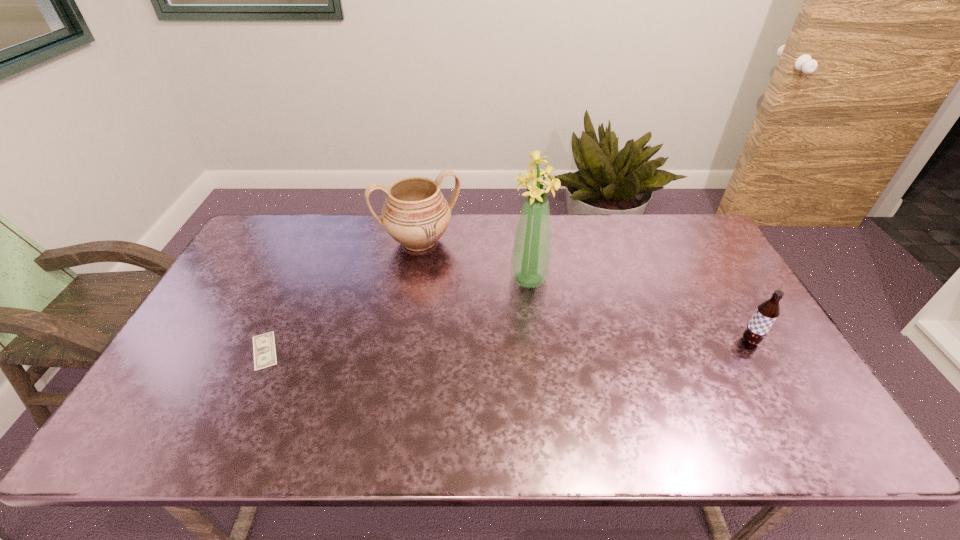
Where is `free space located on the front-facing side of the farthest object`? free space located on the front-facing side of the farthest object is located at coordinates (461, 321).

You are a GUI agent. You are given a task and a screenshot of the screen. Output one action in this format:
    pyautogui.click(x=<x>, y=<y>)
    Task: Click on the vacant area situated on the front-facing side of the farthest object
    
    Given the screenshot: What is the action you would take?
    pyautogui.click(x=449, y=295)

Image resolution: width=960 pixels, height=540 pixels. In order to click on vacant position located 0.250m on the front-facing side of the farthest object in this screenshot , I will do [x=458, y=313].

Identify the location of free location located on the front-facing side of the tallest object. This screenshot has height=540, width=960. (612, 395).

I want to click on free space located 0.350m on the front-facing side of the tallest object, so click(603, 382).

I want to click on vacant space situated on the front-facing side of the tallest object, so click(x=566, y=330).

This screenshot has height=540, width=960. In order to click on object situated at the far edge in this screenshot , I will do `click(415, 214)`.

Where is `object situated at the right edge`? This screenshot has height=540, width=960. object situated at the right edge is located at coordinates (767, 312).

Where is `free space at the far edge of the desktop`? This screenshot has height=540, width=960. free space at the far edge of the desktop is located at coordinates (609, 243).

Find the location of `free spot at the near edge of the desktop`. free spot at the near edge of the desktop is located at coordinates (643, 398).